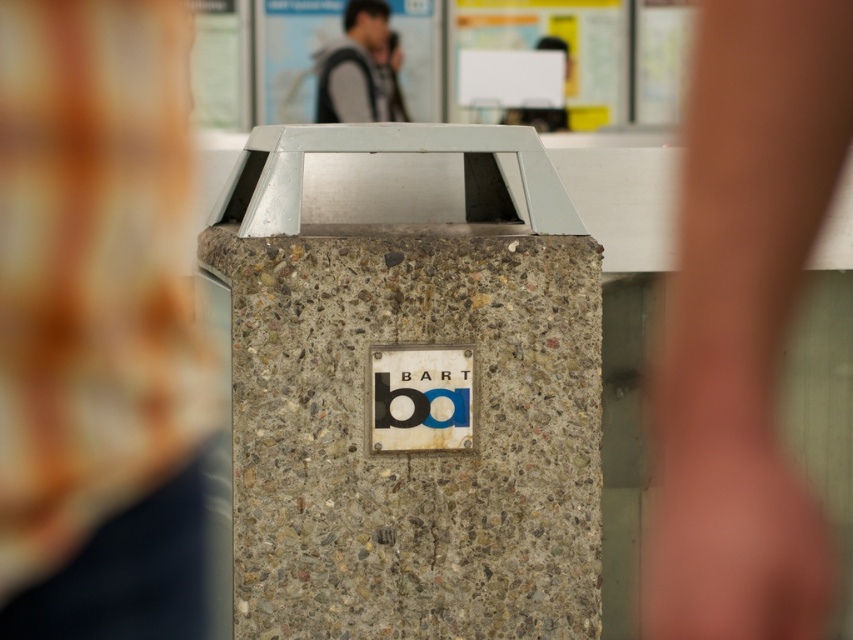
You are standing in a BART station and need to place a small poster on the concrete textured pillar at center. If the poster is 0.5 meters wide, will it fit horizontally on the pillar?

The concrete textured pillar at center is located at point (409, 385). However, the spatial description provided does not include the width of the pillar. Without knowing the pillar width, it is impossible to determine if the poster will fit horizontally.

You are standing in front of the BART trash bin and want to know how far the point at coordinates (263,556) is from your current position. Can you determine the distance?

The point at coordinates (263,556) is 4.12 meters away from the camera, so the distance from your current position to that point is 4.12 meters.

You are standing in a BART station and need to place a 10 feet long banner between the concrete textured pillar at center and the camera. Is there enough space?

The distance between the concrete textured pillar at center and the camera is 13.23 feet, so yes, there is enough space to place a 10 feet long banner between them.